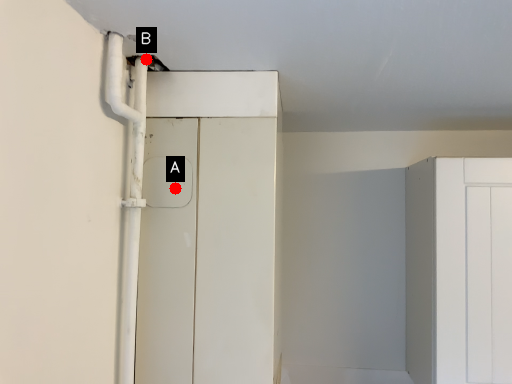
Question: Two points are circled on the image, labeled by A and B beside each circle. Which point is closer to the camera?

Choices:
 (A) A is closer
 (B) B is closer

Answer: (B)